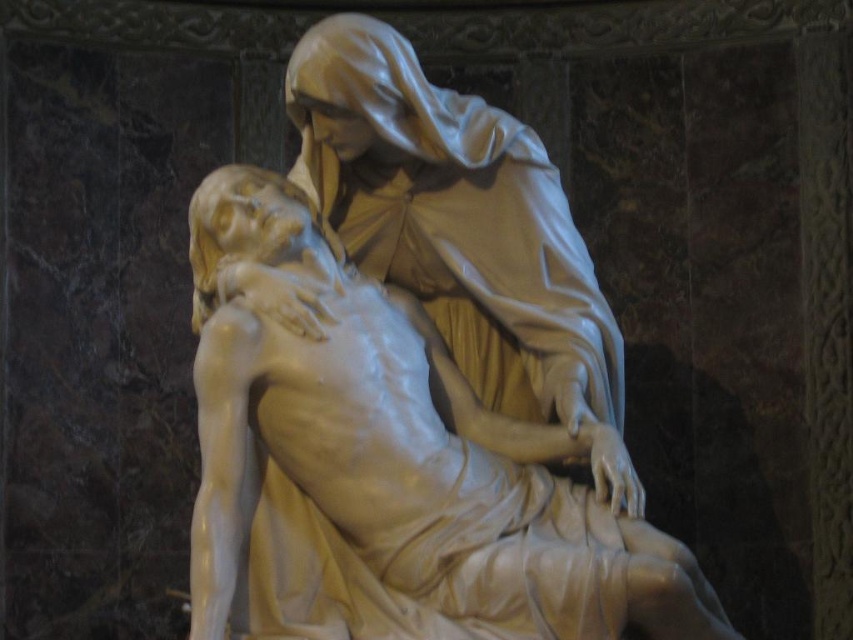
Question: Does white marble statue at center appear over matte white statue at center?

Choices:
 (A) yes
 (B) no

Answer: (B)

Question: Which object is closer to the camera taking this photo?

Choices:
 (A) matte white statue at center
 (B) white marble statue at center

Answer: (B)

Question: Is white marble statue at center thinner than matte white statue at center?

Choices:
 (A) no
 (B) yes

Answer: (A)

Question: Among these points, which one is nearest to the camera?

Choices:
 (A) (506, 353)
 (B) (263, 604)

Answer: (B)

Question: Can you confirm if white marble statue at center is wider than matte white statue at center?

Choices:
 (A) yes
 (B) no

Answer: (A)